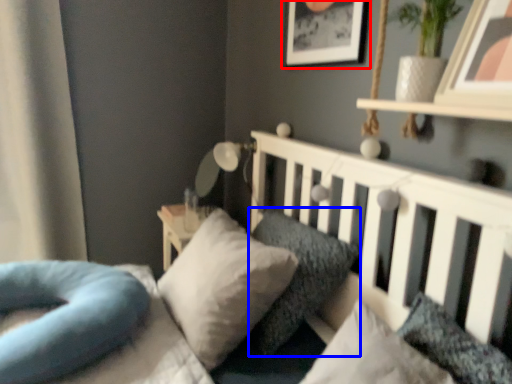
Question: Which object appears farthest to the camera in this image, picture frame (highlighted by a red box) or pillow (highlighted by a blue box)?

Choices:
 (A) picture frame
 (B) pillow

Answer: (A)